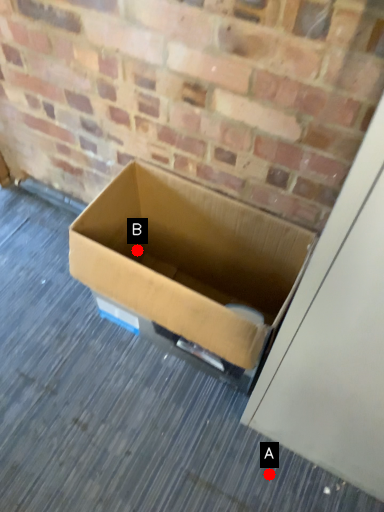
Question: Two points are circled on the image, labeled by A and B beside each circle. Which point is closer to the camera taking this photo?

Choices:
 (A) A is closer
 (B) B is closer

Answer: (A)